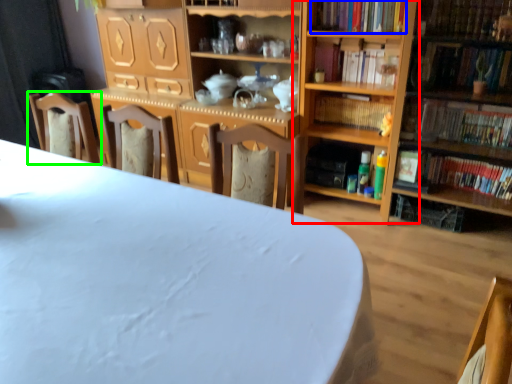
Question: Considering the real-world distances, which object is farthest from shelf (highlighted by a red box)? book (highlighted by a blue box) or chair (highlighted by a green box)?

Choices:
 (A) book
 (B) chair

Answer: (B)